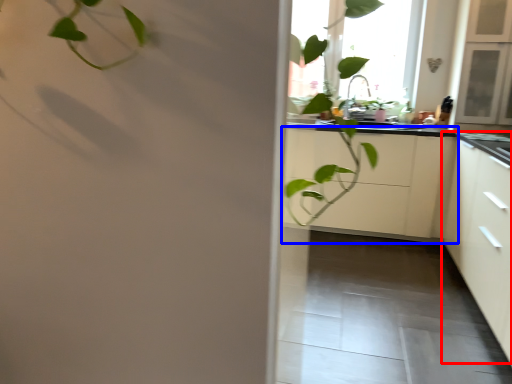
Question: Which object is closer to the camera taking this photo, cabinetry (highlighted by a red box) or cabinetry (highlighted by a blue box)?

Choices:
 (A) cabinetry
 (B) cabinetry

Answer: (A)